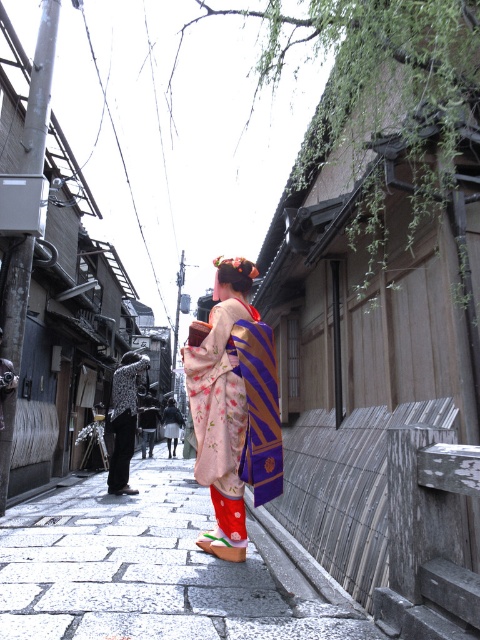
You are a tailor measuring two kimonos displayed in a shop window. The floral silk kimono at center and the black textured kimono at center are both on display. Which kimono has a greater width?

The floral silk kimono at center has a greater width than the black textured kimono at center according to the description.

You are a photographer standing on the street and want to capture both the white stone pavement at center and the floral silk kimono at center in a single frame. Which object should you focus on first to ensure both are in the shot?

The white stone pavement at center is not as tall as the floral silk kimono at center, so you should focus on the floral silk kimono at center first to ensure both are in the shot.